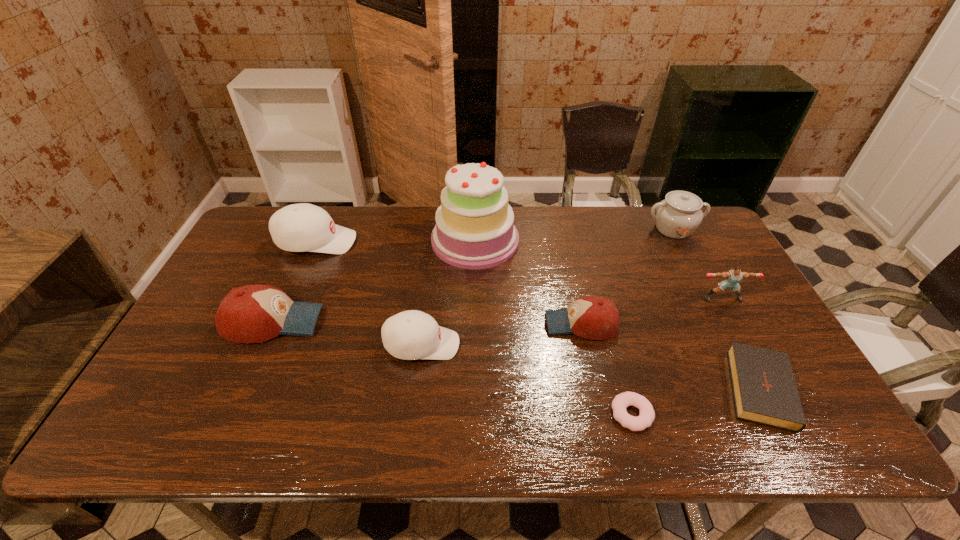
Locate an element on the screen. The image size is (960, 540). puncher that is positioned at the right edge is located at coordinates (734, 276).

At what (x,y) coordinates should I click in order to perform the action: click on Bible present at the right edge. Please return your answer as a coordinate pair (x, y). Image resolution: width=960 pixels, height=540 pixels. Looking at the image, I should click on (764, 389).

Find the location of a particular element. The height and width of the screenshot is (540, 960). object that is at the far left corner is located at coordinates (302, 227).

Find the location of a particular element. The height and width of the screenshot is (540, 960). object that is at the far right corner is located at coordinates 677,216.

Where is `object that is at the near right corner`? The width and height of the screenshot is (960, 540). object that is at the near right corner is located at coordinates (764, 389).

The height and width of the screenshot is (540, 960). In order to click on blank area at the far edge in this screenshot , I will do [x=569, y=213].

This screenshot has height=540, width=960. I want to click on free region at the near edge, so click(228, 414).

Identify the location of vacant space at the left edge of the desktop. The image size is (960, 540). 180,373.

Locate an element on the screen. Image resolution: width=960 pixels, height=540 pixels. vacant region at the right edge of the desktop is located at coordinates (701, 303).

Identify the location of free region at the far left corner of the desktop. The height and width of the screenshot is (540, 960). (252, 241).